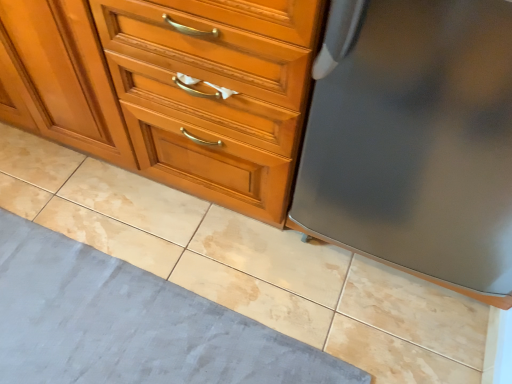
Identify the location of vacant space in gray fabric bath mat at lower left (from a real-world perspective). This screenshot has height=384, width=512. (102, 328).